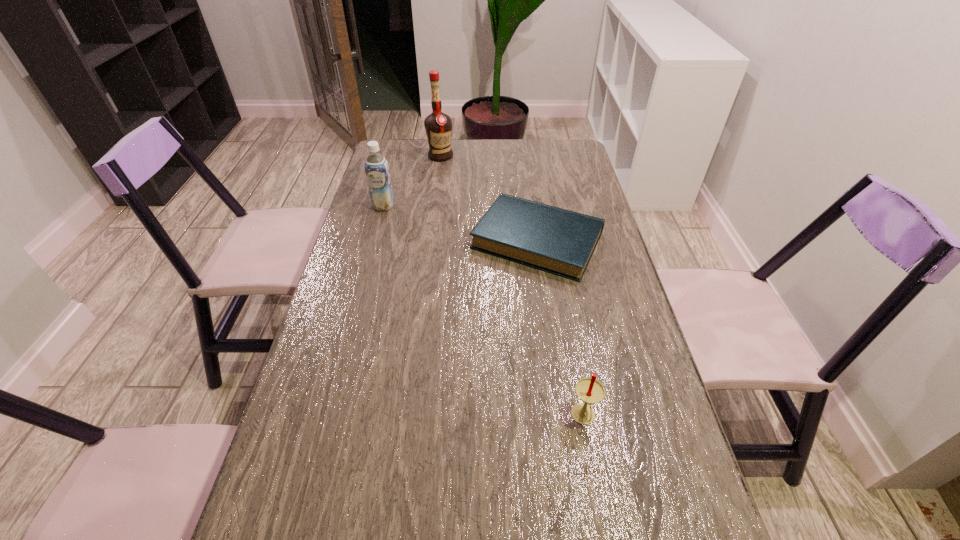
Identify the location of unoccupied position between the tallest object and the candle. (512, 286).

In order to click on vacant area between the book and the leftmost object in this screenshot , I will do `click(460, 223)`.

Where is `unoccupied position between the farthest object and the third shortest object`? This screenshot has height=540, width=960. unoccupied position between the farthest object and the third shortest object is located at coordinates (412, 181).

I want to click on free space that is in between the shortest object and the leftmost object, so click(460, 223).

Locate an element on the screen. The width and height of the screenshot is (960, 540). vacant point located between the third shortest object and the book is located at coordinates (460, 223).

Locate an element on the screen. The image size is (960, 540). vacant space that is in between the candle and the book is located at coordinates (561, 329).

The height and width of the screenshot is (540, 960). In order to click on vacant region between the liquor and the shortest object in this screenshot , I will do `click(489, 198)`.

At what (x,y) coordinates should I click in order to perform the action: click on blank region between the candle and the leftmost object. Please return your answer as a coordinate pair (x, y). Looking at the image, I should click on (484, 312).

At what (x,y) coordinates should I click in order to perform the action: click on free space that is in between the book and the leftmost object. Please return your answer as a coordinate pair (x, y). The width and height of the screenshot is (960, 540). Looking at the image, I should click on (460, 223).

Where is `the second closest object to the book`? The height and width of the screenshot is (540, 960). the second closest object to the book is located at coordinates (438, 126).